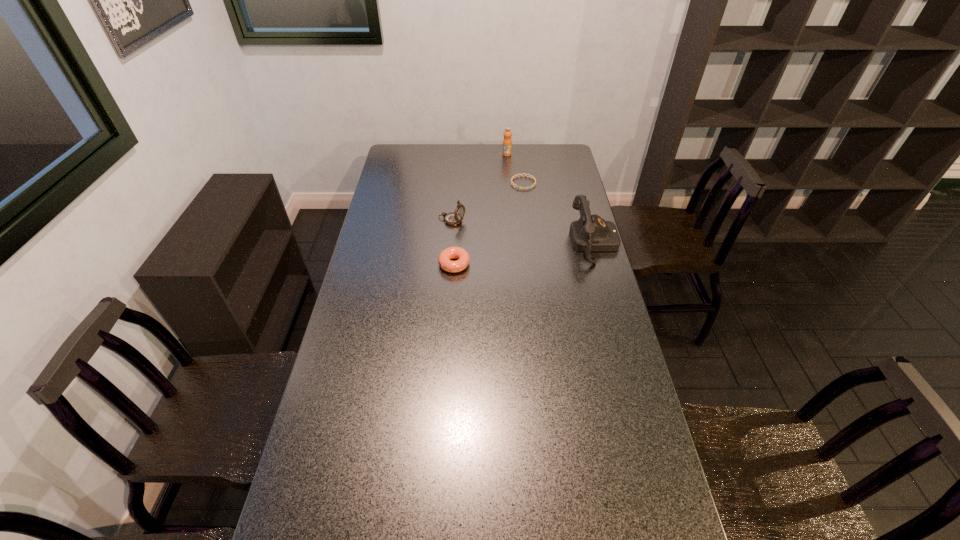
Where is `free spot between the third tallest object and the doughnut`? This screenshot has width=960, height=540. free spot between the third tallest object and the doughnut is located at coordinates (x=453, y=242).

Find the location of a particular element. empty space between the compass and the fourth nearest object is located at coordinates (488, 202).

Locate an element on the screen. This screenshot has width=960, height=540. free spot between the telephone and the shortest object is located at coordinates (559, 213).

You are a GUI agent. You are given a task and a screenshot of the screen. Output one action in this format:
    pyautogui.click(x=<x>, y=<y>)
    Task: Click on the free space between the orange juice and the shortest object
    The height and width of the screenshot is (540, 960).
    Given the screenshot: What is the action you would take?
    pyautogui.click(x=516, y=168)

Identify which object is located as the fourth nearest to the fourth nearest object. Please provide its 2D coordinates. Your answer should be formatted as a tuple, i.e. [(x, y)], where the tuple contains the x and y coordinates of a point satisfying the conditions above.

[(444, 260)]

Image resolution: width=960 pixels, height=540 pixels. Identify the location of the closest object to the shortest object. (507, 142).

I want to click on free spot that satisfies the following two spatial constraints: 1. on the front side of the rightmost object; 2. on the dial of the third shortest object, so click(450, 243).

This screenshot has height=540, width=960. Identify the location of vacant space that satisfies the following two spatial constraints: 1. on the back side of the orange juice; 2. on the left side of the doughnut. (461, 154).

You are a GUI agent. You are given a task and a screenshot of the screen. Output one action in this format:
    pyautogui.click(x=<x>, y=<y>)
    Task: Click on the free space that satisfies the following two spatial constraints: 1. on the back side of the doughnut; 2. on the left side of the bracelet
    This screenshot has height=540, width=960.
    Given the screenshot: What is the action you would take?
    pyautogui.click(x=459, y=183)